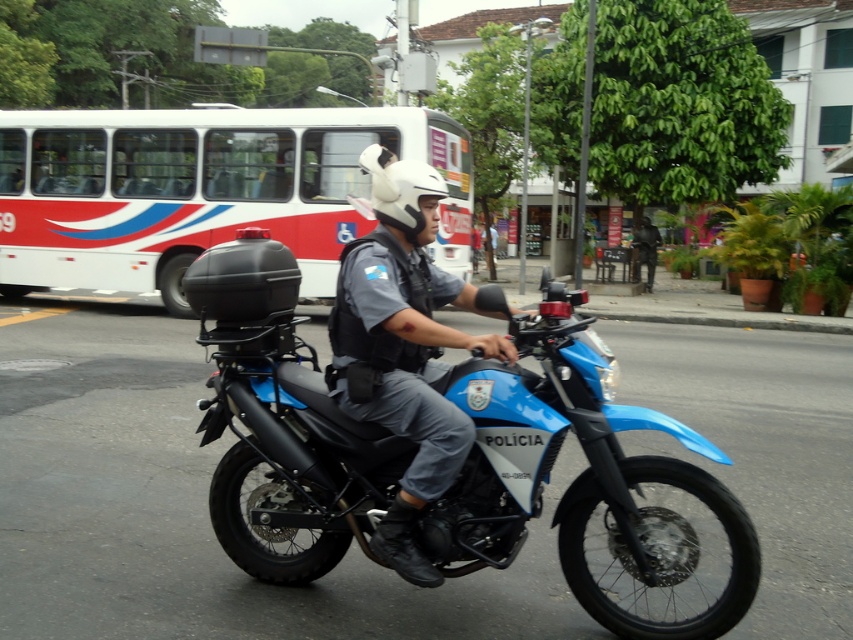
You are a pedestrian standing at the origin point of the coordinate system. The police motorcycle is at point (x=579, y=476). If you want to cross the street to reach the police motorcycle, which direction should you move in?

The blue matte motorcycle at center is located at point (x=579, y=476), so you should move towards that coordinate to reach it.